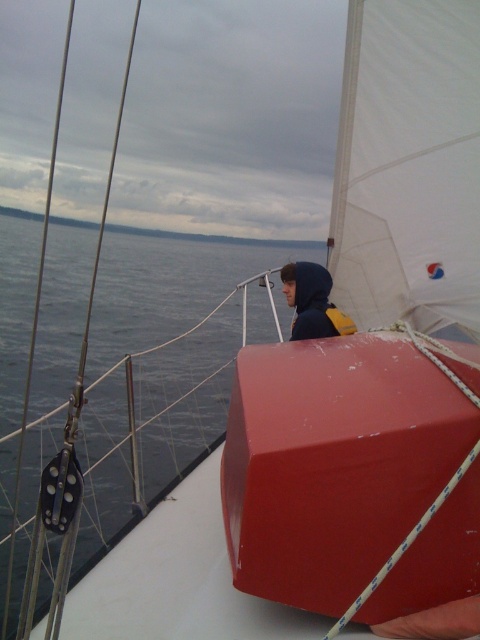
Does matte red box at center appear over matte black hoodie at center?

Incorrect, matte red box at center is not positioned above matte black hoodie at center.

Measure the distance between point (312, 531) and camera.

Point (312, 531) and camera are 1.61 meters apart from each other.

The height and width of the screenshot is (640, 480). What do you see at coordinates (354, 474) in the screenshot?
I see `matte red box at center` at bounding box center [354, 474].

What are the coordinates of `matte red box at center` in the screenshot? It's located at (354, 474).